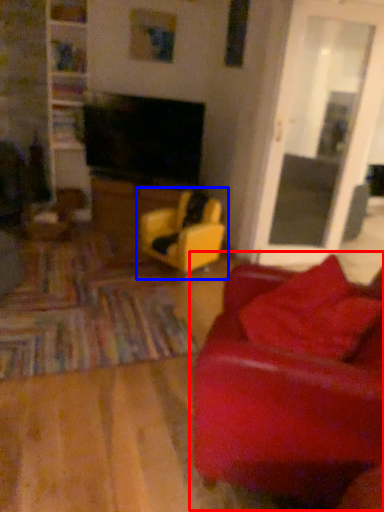
Question: Which of the following is the farthest to the observer, studio couch (highlighted by a red box) or chair (highlighted by a blue box)?

Choices:
 (A) studio couch
 (B) chair

Answer: (B)